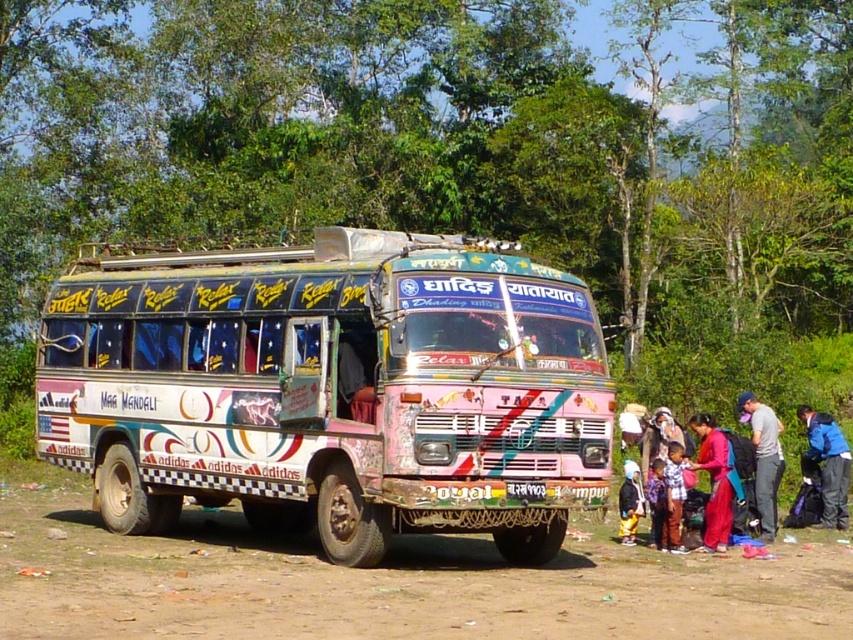
Question: Can you confirm if plaid fabric shirt at lower right is bigger than black fabric child at lower right?

Choices:
 (A) no
 (B) yes

Answer: (A)

Question: Is reddish-pink fabric at lower right bigger than plaid fabric shirt at lower right?

Choices:
 (A) yes
 (B) no

Answer: (A)

Question: Which of these objects is positioned closest to the blue fabric bag at lower right?

Choices:
 (A) reddish-pink fabric at lower right
 (B) plaid fabric shirt at lower right
 (C) matte pink dress at lower right
 (D) painted wood bus at center

Answer: (A)

Question: Which point is farther to the camera?

Choices:
 (A) (722, 464)
 (B) (175, 442)
 (C) (646, 442)
 (D) (843, 444)

Answer: (D)

Question: Among these points, which one is farthest from the camera?

Choices:
 (A) (840, 477)
 (B) (747, 392)

Answer: (B)

Question: In this image, where is painted wood bus at center located relative to black fabric child at lower right?

Choices:
 (A) right
 (B) left

Answer: (B)